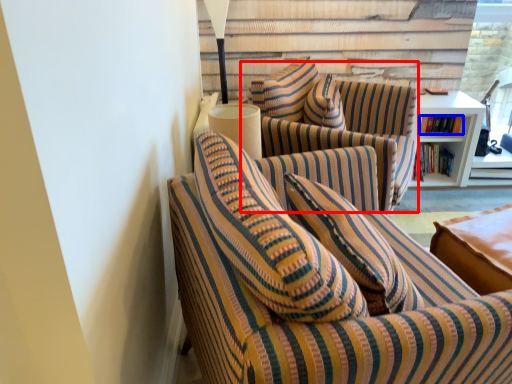
Question: Which point is closer to the camera, swivel chair (highlighted by a red box) or book (highlighted by a blue box)?

Choices:
 (A) swivel chair
 (B) book

Answer: (A)